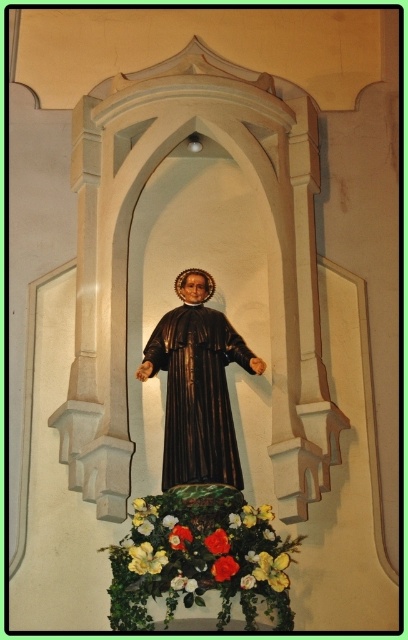
Question: Which point appears farthest from the camera in this image?

Choices:
 (A) (166, 467)
 (B) (175, 522)
 (C) (230, 561)
 (D) (157, 568)

Answer: (A)

Question: Is floral bouquet at lower center smaller than white matte flower at lower center?

Choices:
 (A) no
 (B) yes

Answer: (A)

Question: Can you confirm if yellow matte flower at lower center is positioned below white matte flower at lower center?

Choices:
 (A) yes
 (B) no

Answer: (B)

Question: Is yellow matte flower at lower center positioned in front of white matte flower at lower center?

Choices:
 (A) no
 (B) yes

Answer: (A)

Question: Which is farther from the floral bouquet at lower center?

Choices:
 (A) yellow fabric flower at lower center
 (B) smooth glossy rose at center
 (C) shiny dark brown statue at center
 (D) white matte flower at lower center

Answer: (C)

Question: Which point appears closest to the camera in this image?

Choices:
 (A) (221, 580)
 (B) (248, 588)
 (C) (219, 528)

Answer: (A)